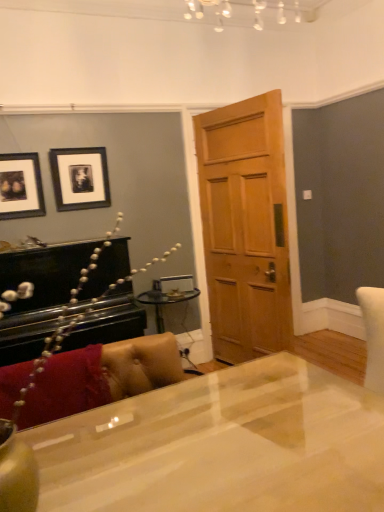
Question: From a real-world perspective, is leather couch at lower left above or below matte black picture frame at upper left, marked as the 2th picture frame in a right-to-left arrangement?

Choices:
 (A) below
 (B) above

Answer: (A)

Question: Which is correct: leather couch at lower left is inside matte black picture frame at upper left, the first picture frame from the left, or outside of it?

Choices:
 (A) outside
 (B) inside

Answer: (A)

Question: Which of these objects is positioned closest to the black matte picture frame at upper left, which is counted as the 1th picture frame, starting from the right?

Choices:
 (A) matte black picture frame at upper left, the first picture frame from the left
 (B) wooden door at center
 (C) glossy white desk at center
 (D) leather couch at lower left

Answer: (A)

Question: Which is nearer to the glossy white desk at center?

Choices:
 (A) matte black picture frame at upper left, marked as the 2th picture frame in a right-to-left arrangement
 (B) black matte picture frame at upper left, placed as the 2th picture frame when sorted from left to right
 (C) wooden door at center
 (D) leather couch at lower left

Answer: (D)